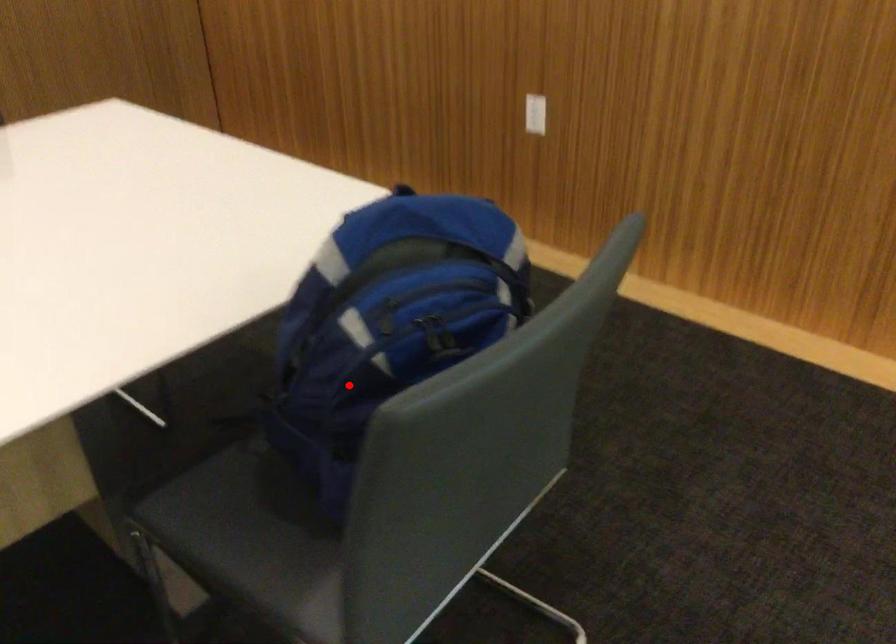
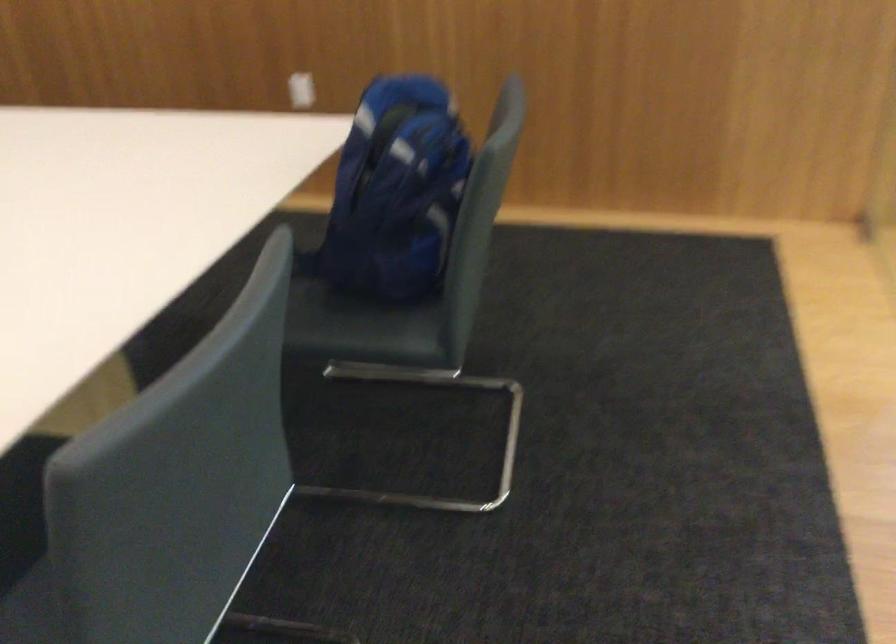
Question: I am providing you with two images of the same scene from different viewpoints. In image1, a red point is highlighted. Considering the same 3D point in image2, which of the following is correct?

Choices:
 (A) It is closer
 (B) It is farther

Answer: (B)